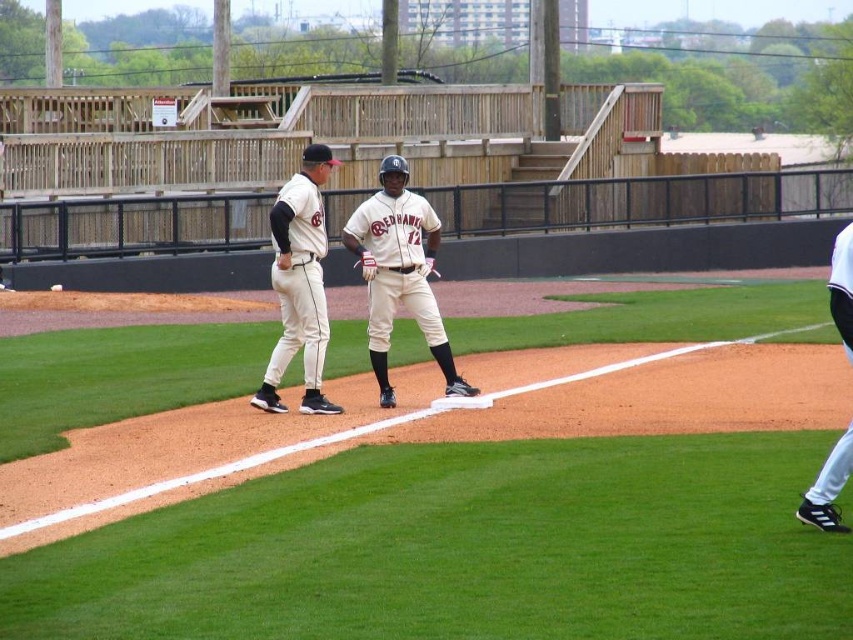
You are a photographer positioned at the origin point of the field. The white uniformed players at center are at coordinates 0.859, 0.545. If you want to take a photo that includes both the players and the outfield fence located at the far edge of the field, which direction should you move to ensure both are in frame?

The white uniformed players at center are located at point (463, 548). To include both them and the outfield fence, you should move towards the direction opposite of the players, likely towards the backstop or the area behind home plate, to widen your field of view and capture both elements in the frame.

You are a photographer trying to capture both the white uniform at center and the white matte uniform at center in a single shot. Given that your camera can only focus on objects within a 3 meter width, will both fit within the frame?

The white uniform at center is larger in width than the white matte uniform at center. However, since the camera can focus on objects within a 3 meter width, both should fit as long as their combined width does not exceed 3 meters. But the exact dimensions are not provided, so it depends on their actual sizes.

You are a photographer positioned at the back of the field. You want to take a photo that includes both the white uniformed players at center and the white matte uniform at center. Which player should you focus on first to ensure both are in frame?

The white uniformed players at center is below the white matte uniform at center, so you should focus on the white matte uniform at center first to ensure both are in frame.